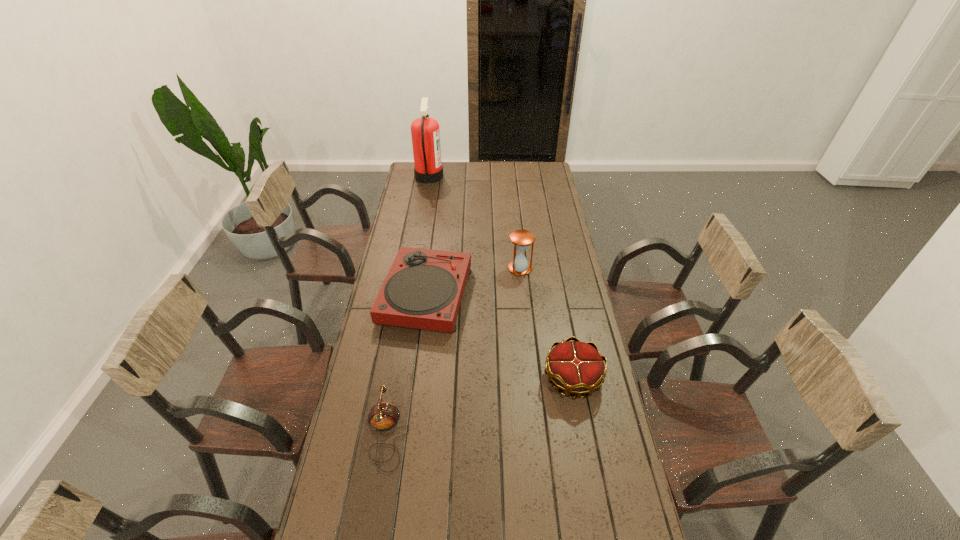
Where is `vacant space situated on the rotary dial of the telephone`? vacant space situated on the rotary dial of the telephone is located at coordinates (484, 434).

At what (x,y) coordinates should I click in order to perform the action: click on object that is at the far edge. Please return your answer as a coordinate pair (x, y). Looking at the image, I should click on (425, 132).

This screenshot has height=540, width=960. I want to click on fire extinguisher that is at the left edge, so click(x=425, y=132).

This screenshot has height=540, width=960. In order to click on record player that is at the left edge in this screenshot , I will do `click(423, 289)`.

You are a GUI agent. You are given a task and a screenshot of the screen. Output one action in this format:
    pyautogui.click(x=<x>, y=<y>)
    Task: Click on the telephone that is positioned at the left edge
    The width and height of the screenshot is (960, 540).
    Given the screenshot: What is the action you would take?
    pyautogui.click(x=384, y=416)

At what (x,y) coordinates should I click in order to perform the action: click on object at the right edge. Please return your answer as a coordinate pair (x, y). The image size is (960, 540). Looking at the image, I should click on (576, 367).

I want to click on object that is at the far left corner, so click(425, 132).

This screenshot has height=540, width=960. In the image, there is a desktop. In order to click on vacant space at the far edge in this screenshot , I will do `click(517, 176)`.

Identify the location of vacant region at the left edge of the desktop. Image resolution: width=960 pixels, height=540 pixels. (403, 389).

Locate an element on the screen. free space at the right edge is located at coordinates (629, 482).